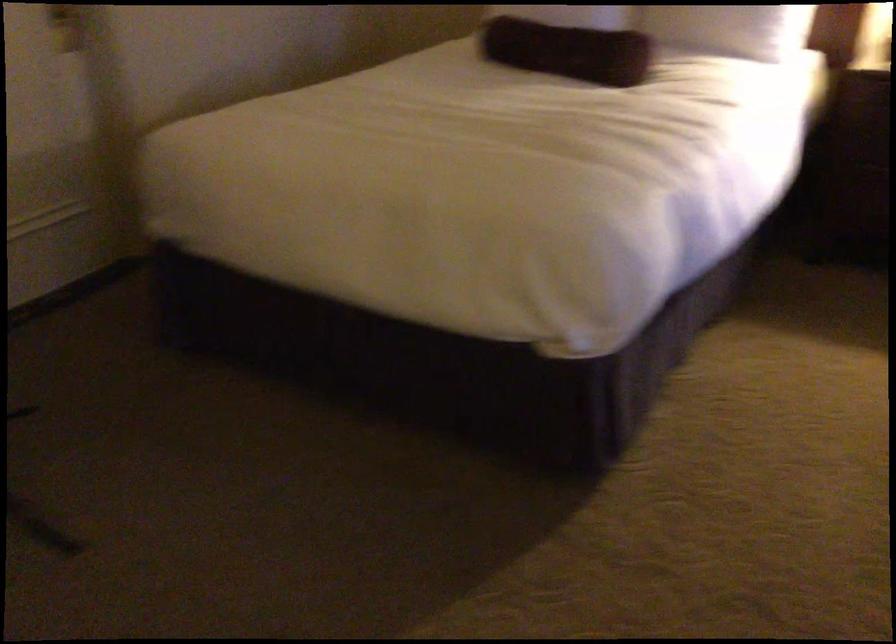
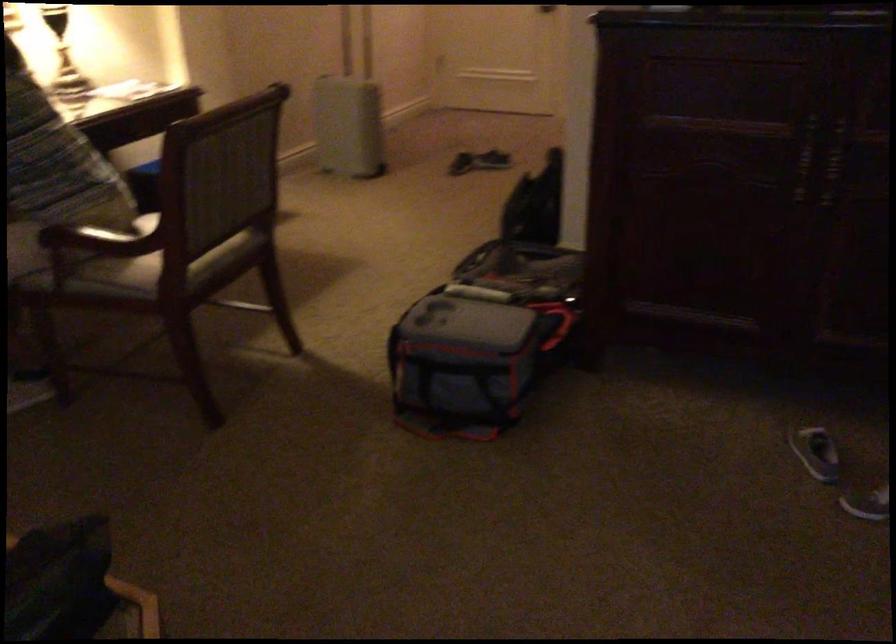
How did the camera likely rotate?

The camera rotated toward left-down.